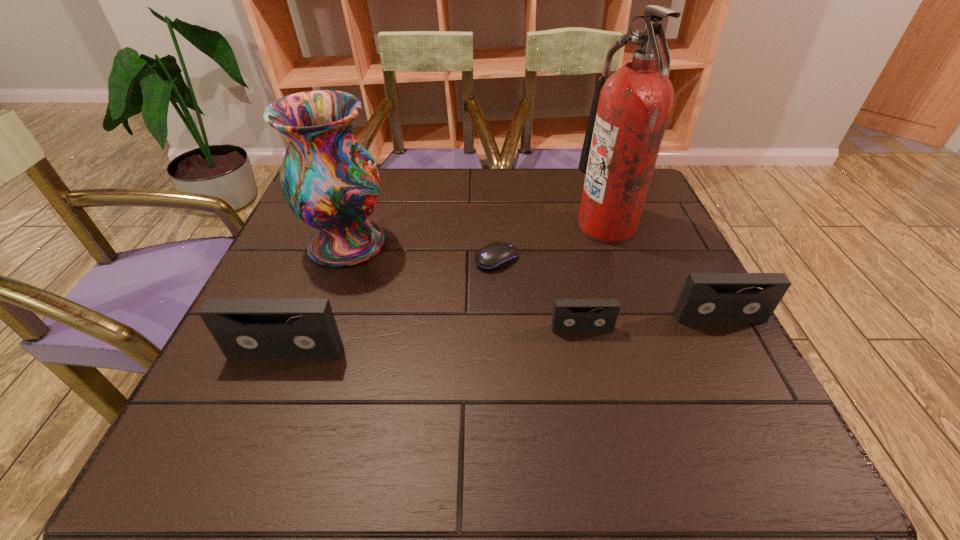
Where is `the leftmost videotape`? The width and height of the screenshot is (960, 540). the leftmost videotape is located at coordinates pyautogui.click(x=244, y=328).

Find the location of a particular element. The image size is (960, 540). the nearest object is located at coordinates (244, 328).

Locate an element on the screen. The image size is (960, 540). the second nearest object is located at coordinates (569, 315).

This screenshot has height=540, width=960. I want to click on the second videotape from left to right, so click(569, 315).

Locate an element on the screen. The height and width of the screenshot is (540, 960). the rightmost object is located at coordinates (706, 297).

Locate an element on the screen. The image size is (960, 540). the fourth farthest object is located at coordinates (706, 297).

I want to click on the fourth object from right to left, so click(x=497, y=255).

Locate an element on the screen. computer mouse is located at coordinates click(497, 255).

You are a GUI agent. You are given a task and a screenshot of the screen. Output one action in this format:
    pyautogui.click(x=<x>, y=<y>)
    Task: Click on the vase
    This screenshot has width=960, height=540.
    Given the screenshot: What is the action you would take?
    pyautogui.click(x=329, y=180)

You are a GUI agent. You are given a task and a screenshot of the screen. Output one action in this format:
    pyautogui.click(x=<x>, y=<y>)
    Task: Click on the tallest object
    This screenshot has height=540, width=960.
    Given the screenshot: What is the action you would take?
    pyautogui.click(x=630, y=109)